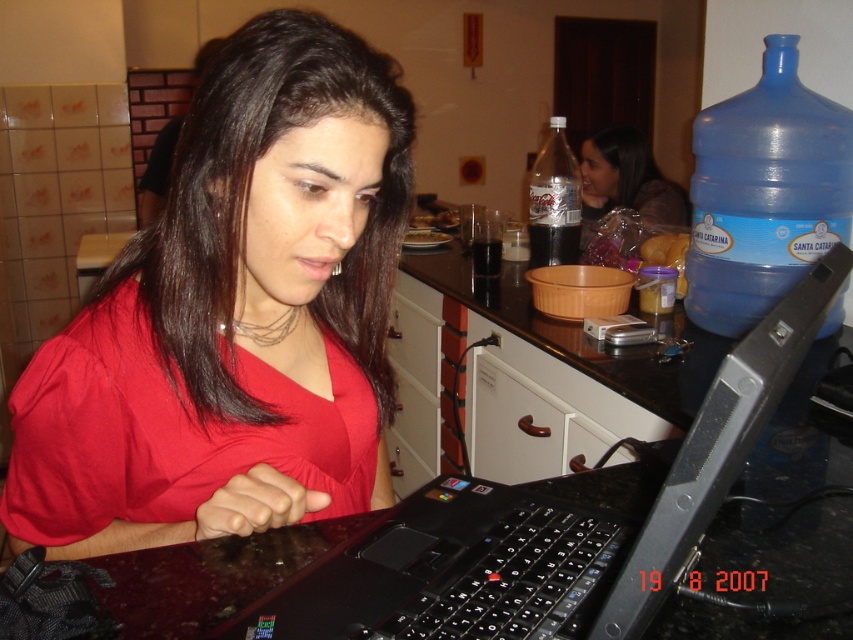
You are a photographer setting up a shot in the kitchen. You need to focus on the matte red shirt at center and the blue plastic bottle at upper right. Which object should you prioritize focusing on first to ensure both are in sharp focus?

The matte red shirt at center is closer to the viewer than the blue plastic bottle at upper right, so you should focus on the matte red shirt at center first to ensure both are in sharp focus.

You are standing in the kitchen and want to move from the point at coordinates point [236,625] to the point at coordinates point [570,152]. Which direction should you move in to reach the second point?

To move from point [236,625] to point [570,152], you should move towards the left and upwards since point [236,625] is in front of point [570,152].

You are standing in the kitchen and want to reach a point marked as point (798, 332). If your arm can extend 16 inches, can you reach that point without moving?

The distance between you and point (798, 332) is 17.14 inches, which is slightly beyond your arm reach of 16 inches. Therefore, you cannot reach it without moving closer.